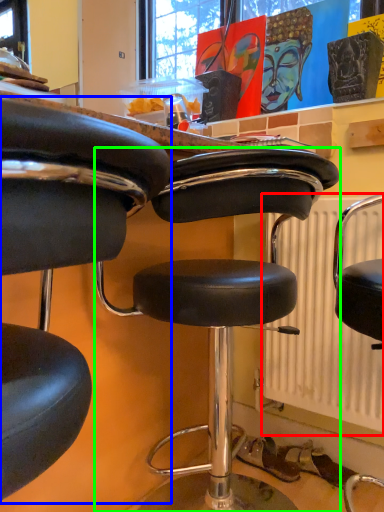
Question: Which is farther away from radiator (highlighted by a red box)? chair (highlighted by a blue box) or chair (highlighted by a green box)?

Choices:
 (A) chair
 (B) chair

Answer: (A)